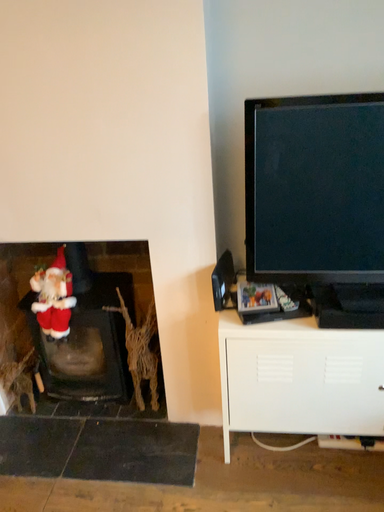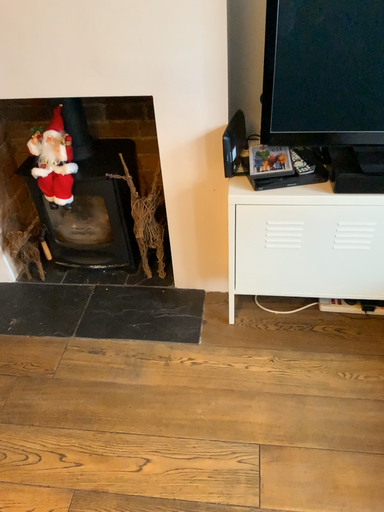
Question: How did the camera likely rotate when shooting the video?

Choices:
 (A) rotated upward
 (B) rotated downward

Answer: (B)